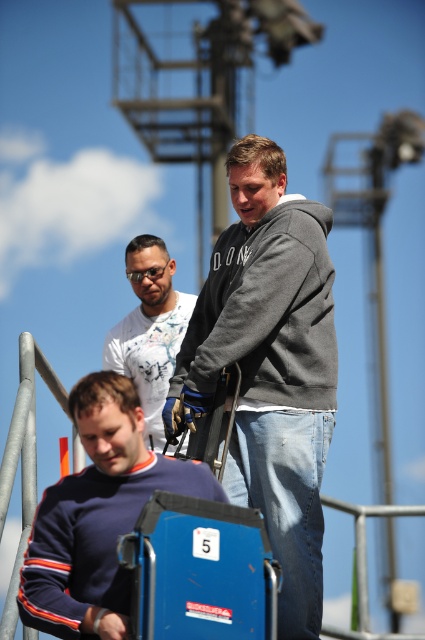
You are observing a construction site and notice two items in the foreground. The first is a navy blue sweater at lower left, and the second is a blue plastic lift at lower center. Based on their positions, which item is closer to the viewer?

The navy blue sweater at lower left is closer to the viewer because it is positioned above the blue plastic lift at lower center, indicating it is nearer in the visual plane.